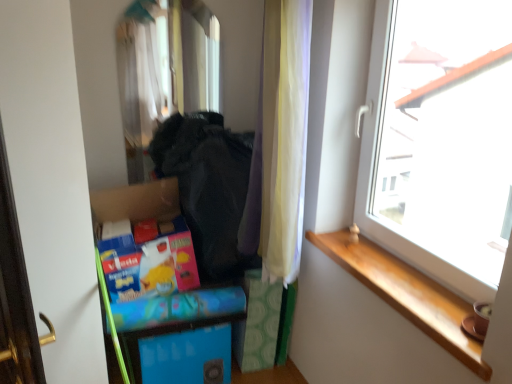
Question: Does white sheer curtain at center lie in front of transparent glass window at upper right?

Choices:
 (A) no
 (B) yes

Answer: (A)

Question: Is white sheer curtain at center facing away from transparent glass window at upper right?

Choices:
 (A) yes
 (B) no

Answer: (A)

Question: Considering the relative positions of white sheer curtain at center and transparent glass window at upper right in the image provided, is white sheer curtain at center to the left of transparent glass window at upper right from the viewer's perspective?

Choices:
 (A) no
 (B) yes

Answer: (B)

Question: Is white sheer curtain at center completely or partially outside of transparent glass window at upper right?

Choices:
 (A) no
 (B) yes

Answer: (B)

Question: Can you confirm if white sheer curtain at center is bigger than transparent glass window at upper right?

Choices:
 (A) yes
 (B) no

Answer: (B)

Question: From the image's perspective, does white sheer curtain at center appear lower than transparent glass window at upper right?

Choices:
 (A) yes
 (B) no

Answer: (A)

Question: Would you say wooden at right is a long distance from transparent glass window at upper right?

Choices:
 (A) no
 (B) yes

Answer: (A)

Question: Can you confirm if wooden at right is wider than transparent glass window at upper right?

Choices:
 (A) no
 (B) yes

Answer: (B)

Question: Is wooden at right next to transparent glass window at upper right?

Choices:
 (A) no
 (B) yes

Answer: (A)

Question: Is the position of wooden at right more distant than that of transparent glass window at upper right?

Choices:
 (A) yes
 (B) no

Answer: (A)

Question: Can you confirm if wooden at right is thinner than transparent glass window at upper right?

Choices:
 (A) no
 (B) yes

Answer: (A)

Question: Is wooden at right positioned beyond the bounds of transparent glass window at upper right?

Choices:
 (A) yes
 (B) no

Answer: (A)

Question: Can you confirm if wooden at right is positioned to the right of black fabric at center?

Choices:
 (A) no
 (B) yes

Answer: (B)